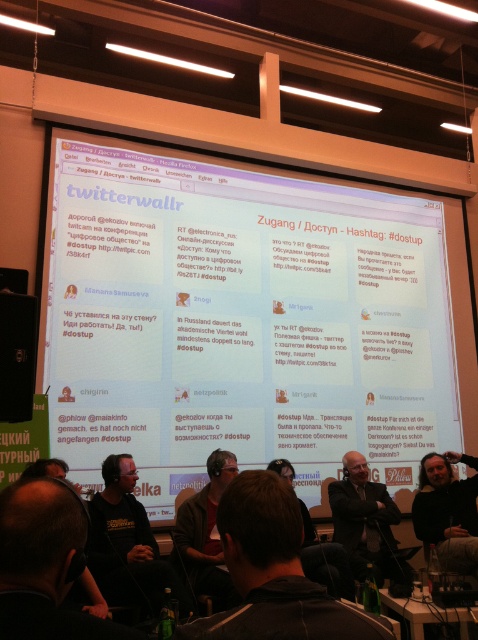
Question: Is brown leather jacket at center above dark gray suit at center?

Choices:
 (A) yes
 (B) no

Answer: (A)

Question: Estimate the real-world distances between objects in this image. Which object is farther from the dark brown leather jacket at center?

Choices:
 (A) white matte projection screen at center
 (B) dark brown leather jacket at lower left
 (C) dark brown leather jacket at lower right
 (D) black leather jacket at center

Answer: (A)

Question: Is dark brown leather jacket at lower left below dark gray suit at center?

Choices:
 (A) yes
 (B) no

Answer: (B)

Question: Can you confirm if dark brown leather jacket at lower left is positioned below black leather jacket at center?

Choices:
 (A) yes
 (B) no

Answer: (B)

Question: Which point is closer to the camera taking this photo?

Choices:
 (A) tap(24, 332)
 (B) tap(31, 624)

Answer: (B)

Question: Which point is farther from the camera taking this photo?

Choices:
 (A) (35, 561)
 (B) (235, 472)
 (C) (335, 525)

Answer: (C)